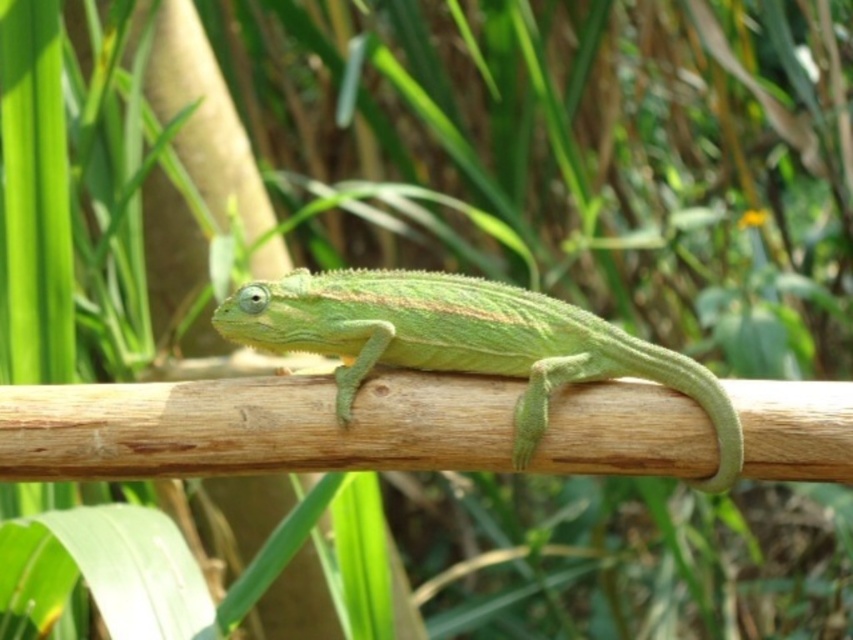
Who is lower down, smooth wood branch at center or green matte lizard at center?

Positioned lower is smooth wood branch at center.

Is smooth wood branch at center wider than green matte lizard at center?

Indeed, smooth wood branch at center has a greater width compared to green matte lizard at center.

Who is more forward, [312,384] or [717,408]?

Point [312,384] is more forward.

Locate an element on the screen. The image size is (853, 640). smooth wood branch at center is located at coordinates (254, 426).